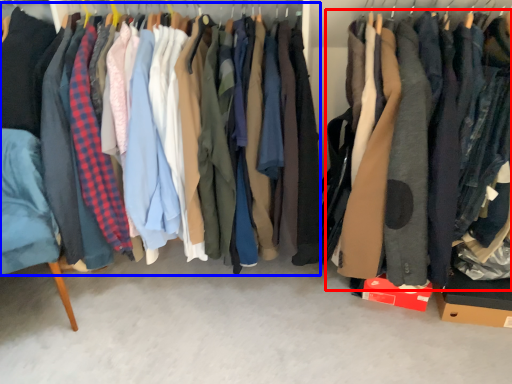
Question: Among these objects, which one is nearest to the camera, clothing (highlighted by a red box) or closet (highlighted by a blue box)?

Choices:
 (A) clothing
 (B) closet

Answer: (A)